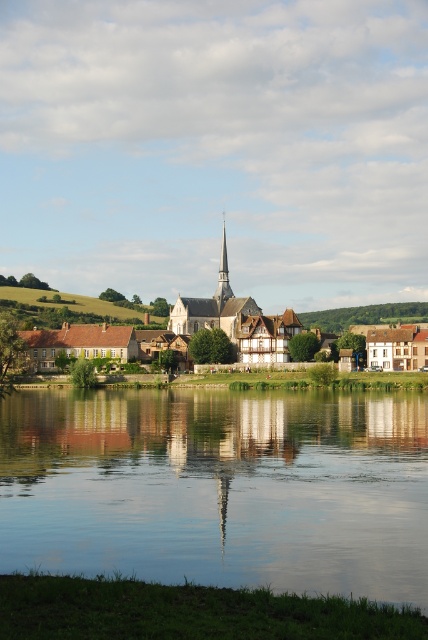
Question: Which object is positioned closest to the transparent glass water at center?

Choices:
 (A) smooth white spire at center
 (B) white wooden houses at center

Answer: (B)

Question: Which point is farther from the camera taking this photo?

Choices:
 (A) (231, 316)
 (B) (285, 324)
 (C) (222, 280)

Answer: (C)

Question: Which of the following is the farthest from the observer?

Choices:
 (A) (419, 520)
 (B) (199, 324)
 (C) (229, 317)
 (D) (228, 282)

Answer: (D)

Question: Can you confirm if transparent glass water at center is positioned to the left of white wooden houses at center?

Choices:
 (A) yes
 (B) no

Answer: (A)

Question: Is transparent glass water at center smaller than smooth white spire at center?

Choices:
 (A) yes
 (B) no

Answer: (B)

Question: Is white wooden houses at center further to camera compared to smooth white spire at center?

Choices:
 (A) no
 (B) yes

Answer: (A)